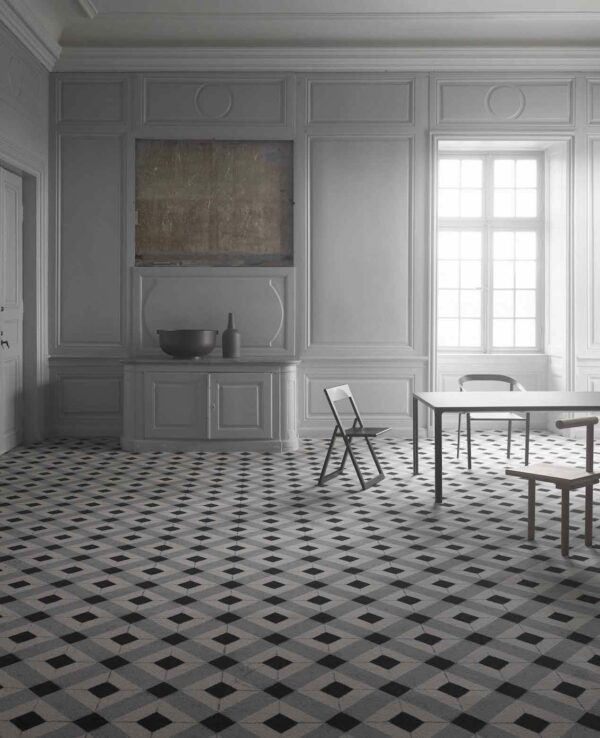
This screenshot has height=738, width=600. I want to click on table, so click(x=469, y=400).